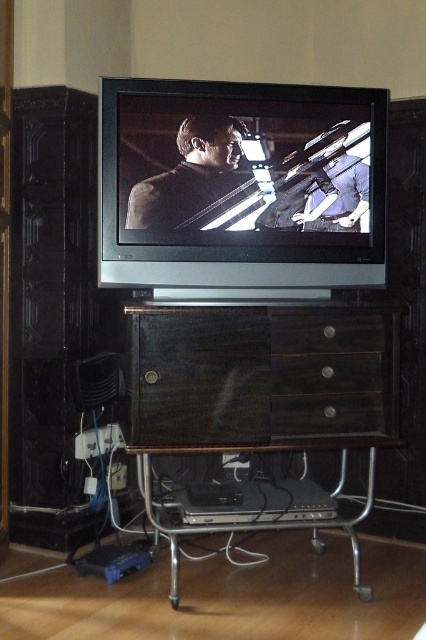
Question: Which point is closer to the camera?

Choices:
 (A) dark wood cabinet at center
 (B) dark wood drawer at center
 (C) matte black suit at center

Answer: (A)

Question: Where is dark wood cabinet at center located in relation to matte black suit at center in the image?

Choices:
 (A) right
 (B) left

Answer: (A)

Question: Can you confirm if matte black suit at center is wider than brown wood drawer at center?

Choices:
 (A) yes
 (B) no

Answer: (A)

Question: Which of the following is the closest to the observer?

Choices:
 (A) (279, 168)
 (B) (233, 196)

Answer: (B)

Question: Estimate the real-world distances between objects in this image. Which object is farther from the brown wood drawer at center?

Choices:
 (A) matte black suit at center
 (B) dark wood drawer at center
 (C) silver metallic flat screen tv at center
 (D) dark wood cabinet at center

Answer: (A)

Question: Does dark wood drawer at center have a lesser width compared to brown wood drawer at center?

Choices:
 (A) no
 (B) yes

Answer: (A)